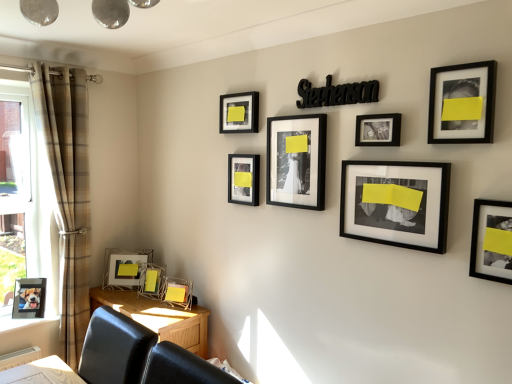
Question: Is metallic silver picture frame at lower left, which appears as the ninth picture frame when viewed from the right, bigger than matte black photo frame at center, the 6th picture frame from the right?

Choices:
 (A) yes
 (B) no

Answer: (A)

Question: Is metallic silver picture frame at lower left, the 2th picture frame in the left-to-right sequence, smaller than matte black photo frame at center, the 6th picture frame from the right?

Choices:
 (A) no
 (B) yes

Answer: (A)

Question: Can you confirm if metallic silver picture frame at lower left, which appears as the ninth picture frame when viewed from the right, is shorter than matte black photo frame at center, the 6th picture frame from the right?

Choices:
 (A) yes
 (B) no

Answer: (B)

Question: Could you tell me if metallic silver picture frame at lower left, the 2th picture frame in the left-to-right sequence, is facing matte black photo frame at center, the 6th picture frame from the right?

Choices:
 (A) no
 (B) yes

Answer: (A)

Question: Can you confirm if metallic silver picture frame at lower left, which appears as the ninth picture frame when viewed from the right, is positioned to the right of matte black photo frame at center, arranged as the fifth picture frame when viewed from the left?

Choices:
 (A) no
 (B) yes

Answer: (A)

Question: Is metallic silver picture frame at lower left, the 2th picture frame in the left-to-right sequence, positioned before matte black photo frame at center, the 6th picture frame from the right?

Choices:
 (A) yes
 (B) no

Answer: (B)

Question: Is black matte picture frame at upper right, arranged as the ninth picture frame when viewed from the left, positioned with its back to matte glass picture frame at lower left, which is counted as the 3th picture frame, starting from the left?

Choices:
 (A) yes
 (B) no

Answer: (B)

Question: Is black matte picture frame at upper right, arranged as the ninth picture frame when viewed from the left, in front of matte glass picture frame at lower left, the 8th picture frame viewed from the right?

Choices:
 (A) no
 (B) yes

Answer: (B)

Question: Considering the relative positions of black matte picture frame at upper right, arranged as the ninth picture frame when viewed from the left, and matte glass picture frame at lower left, the 8th picture frame viewed from the right, in the image provided, is black matte picture frame at upper right, arranged as the ninth picture frame when viewed from the left, to the right of matte glass picture frame at lower left, the 8th picture frame viewed from the right, from the viewer's perspective?

Choices:
 (A) no
 (B) yes

Answer: (B)

Question: Is black matte picture frame at upper right, arranged as the ninth picture frame when viewed from the left, further to the viewer compared to matte glass picture frame at lower left, which is counted as the 3th picture frame, starting from the left?

Choices:
 (A) no
 (B) yes

Answer: (A)

Question: Does black matte picture frame at upper right, the second picture frame viewed from the right, have a lesser width compared to matte glass picture frame at lower left, which is counted as the 3th picture frame, starting from the left?

Choices:
 (A) no
 (B) yes

Answer: (B)

Question: Considering the relative sizes of black matte picture frame at upper right, arranged as the ninth picture frame when viewed from the left, and matte glass picture frame at lower left, which is counted as the 3th picture frame, starting from the left, in the image provided, is black matte picture frame at upper right, arranged as the ninth picture frame when viewed from the left, bigger than matte glass picture frame at lower left, which is counted as the 3th picture frame, starting from the left,?

Choices:
 (A) no
 (B) yes

Answer: (A)

Question: Is metallic silver picture frame at lower left, which appears as the ninth picture frame when viewed from the right, outside of matte black picture frame at upper center, which is the 4th picture frame from left to right?

Choices:
 (A) yes
 (B) no

Answer: (A)